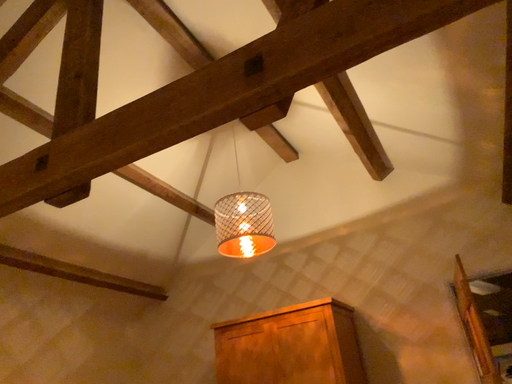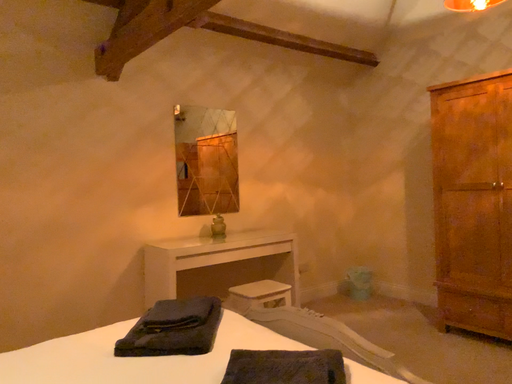
Question: Which way did the camera rotate in the video?

Choices:
 (A) rotated upward
 (B) rotated downward

Answer: (B)